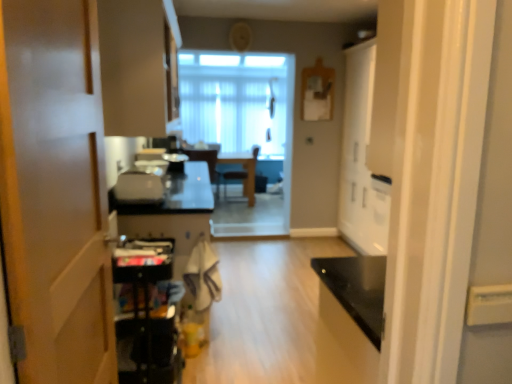
Question: Is translucent glass window at center bigger than matte beige cabinet at upper left?

Choices:
 (A) no
 (B) yes

Answer: (A)

Question: Is translucent glass window at center not within matte beige cabinet at upper left?

Choices:
 (A) no
 (B) yes

Answer: (B)

Question: Does translucent glass window at center come behind matte beige cabinet at upper left?

Choices:
 (A) yes
 (B) no

Answer: (A)

Question: Can you confirm if translucent glass window at center is shorter than matte beige cabinet at upper left?

Choices:
 (A) yes
 (B) no

Answer: (B)

Question: Does translucent glass window at center have a smaller size compared to matte beige cabinet at upper left?

Choices:
 (A) no
 (B) yes

Answer: (B)

Question: In terms of height, does metallic black cart at lower left, placed as the first appliance when sorted from front to back, look taller or shorter compared to wooden chair at center, acting as the second chair starting from the left?

Choices:
 (A) tall
 (B) short

Answer: (B)

Question: Is point (124, 256) positioned closer to the camera than point (227, 162)?

Choices:
 (A) farther
 (B) closer

Answer: (B)

Question: From the image's perspective, is metallic black cart at lower left, which appears as the third appliance when viewed from the top, located above or below wooden chair at center, acting as the second chair starting from the left?

Choices:
 (A) below
 (B) above

Answer: (A)

Question: Is metallic black cart at lower left, placed as the first appliance when sorted from front to back, to the left or to the right of wooden chair at center, acting as the first chair starting from the right, in the image?

Choices:
 (A) left
 (B) right

Answer: (A)

Question: Looking at the image, does metallic black cart at lower left, marked as the third appliance in a back-to-front arrangement, seem bigger or smaller compared to matte beige cabinet at upper left?

Choices:
 (A) big
 (B) small

Answer: (B)

Question: Is metallic black cart at lower left, which appears as the third appliance when viewed from the top, in front of or behind matte beige cabinet at upper left in the image?

Choices:
 (A) front
 (B) behind

Answer: (A)

Question: From the image's perspective, relative to matte beige cabinet at upper left, is metallic black cart at lower left, which appears as the third appliance when viewed from the top, above or below?

Choices:
 (A) above
 (B) below

Answer: (B)

Question: Is point (160, 281) closer or farther from the camera than point (147, 56)?

Choices:
 (A) farther
 (B) closer

Answer: (B)

Question: Looking at their shapes, would you say matte beige cabinet at upper left is wider or thinner than white glossy cabinet at right, which ranks as the second door in front-to-back order?

Choices:
 (A) wide
 (B) thin

Answer: (B)

Question: Does point (112, 34) appear closer or farther from the camera than point (358, 74)?

Choices:
 (A) closer
 (B) farther

Answer: (A)